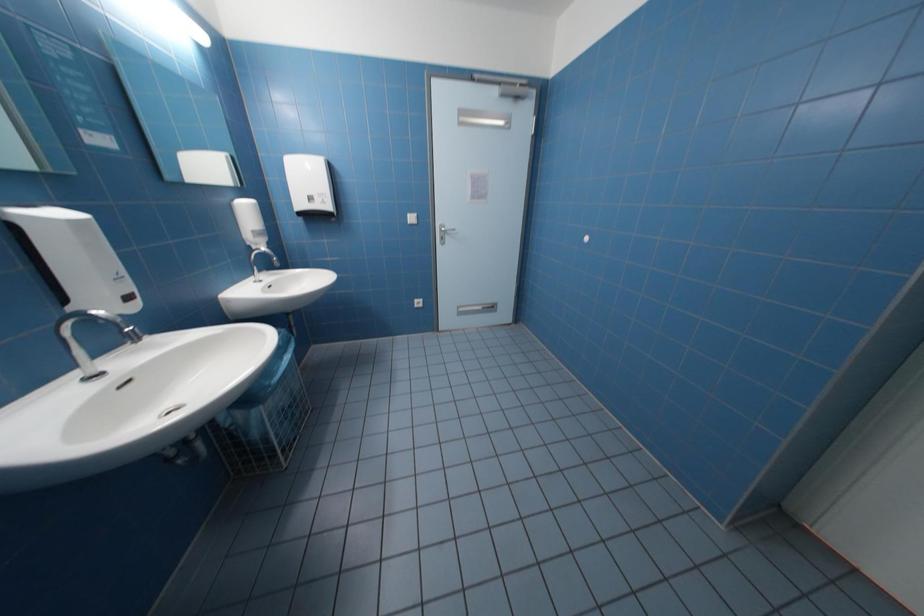
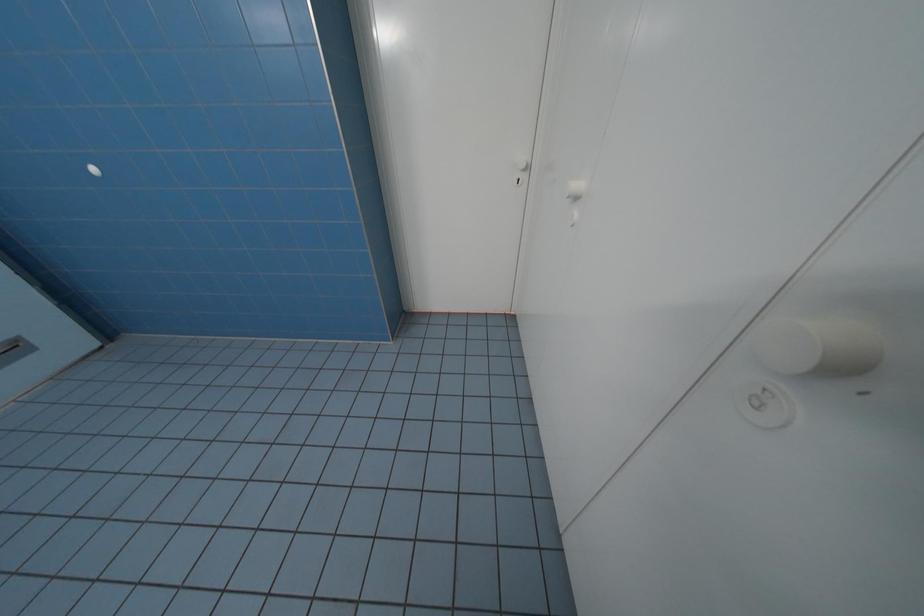
Based on the continuous images, in which direction is the camera rotating?

The camera's rotation is toward right-down.